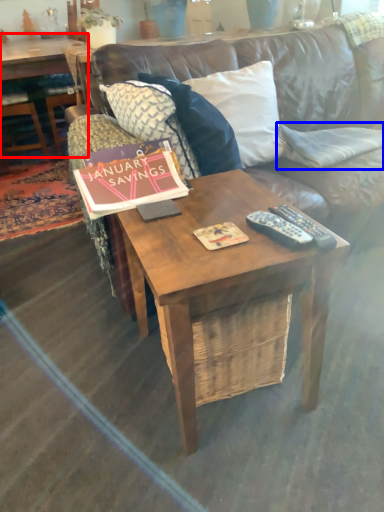
Question: Which object appears farthest to the camera in this image, coffee table (highlighted by a red box) or pillow (highlighted by a blue box)?

Choices:
 (A) coffee table
 (B) pillow

Answer: (A)